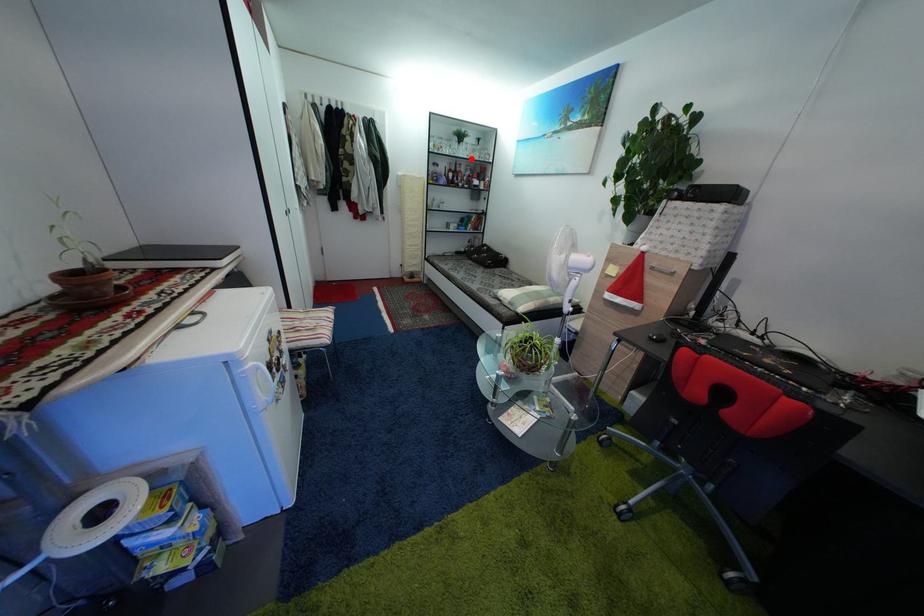
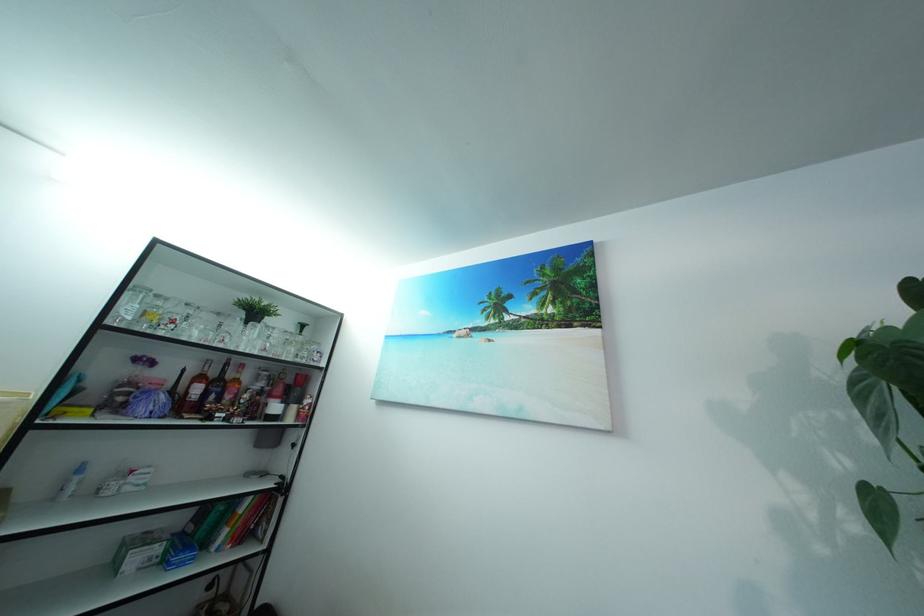
The point at the highlighted location is marked in the first image. Where is the corresponding point in the second image?

(257, 347)